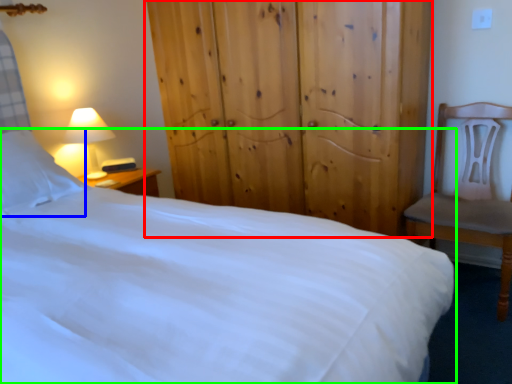
Question: Which object is the closest to the dresser (highlighted by a red box)? Choose among these: pillow (highlighted by a blue box) or bed (highlighted by a green box).

Choices:
 (A) pillow
 (B) bed

Answer: (B)